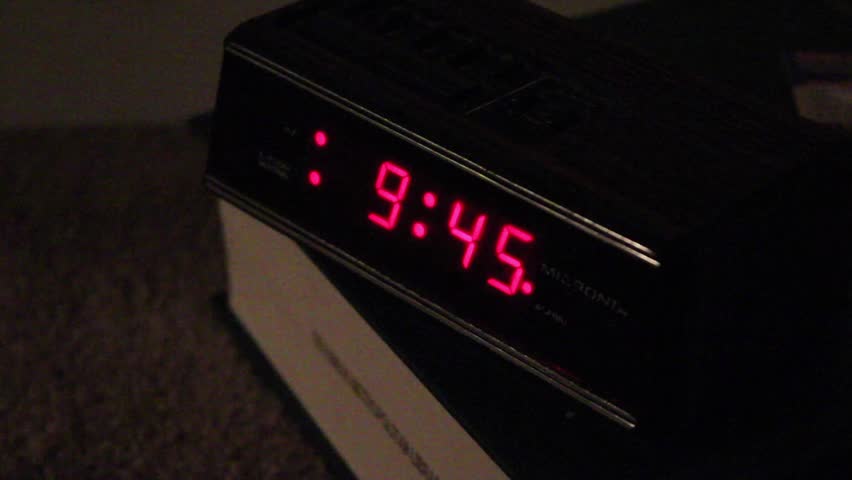
In order to click on book in this screenshot , I will do [401, 441].